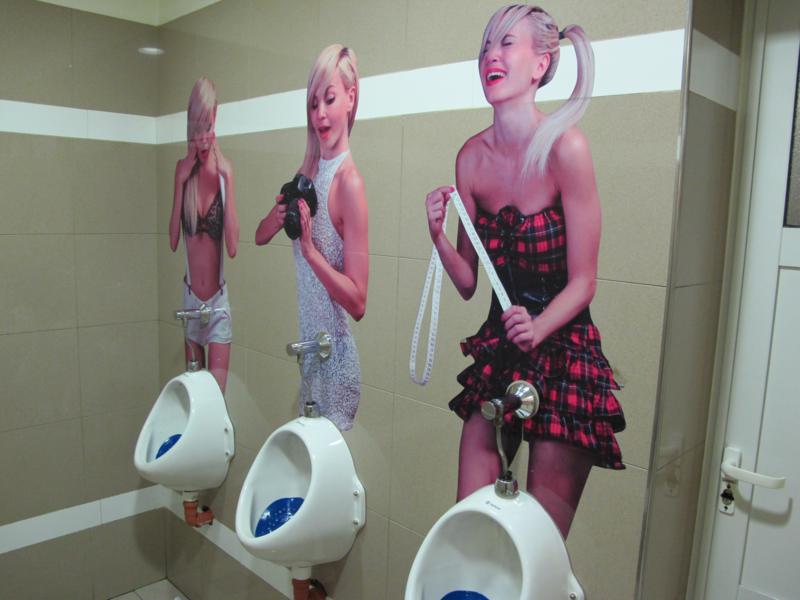
Image resolution: width=800 pixels, height=600 pixels. In order to click on door in this screenshot , I will do pyautogui.click(x=782, y=406).